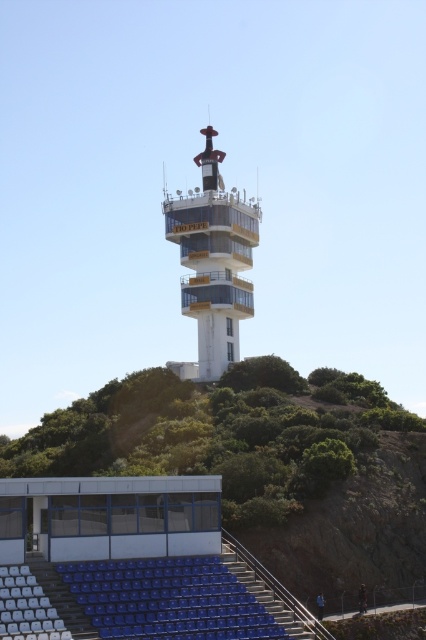
Does white glass amphitheater at lower left appear on the right side of white glossy tower at center?

No, white glass amphitheater at lower left is not to the right of white glossy tower at center.

Can you confirm if white glass amphitheater at lower left is positioned above white glossy tower at center?

No, white glass amphitheater at lower left is not above white glossy tower at center.

Find the location of a particular element. Image resolution: width=426 pixels, height=640 pixels. white glass amphitheater at lower left is located at coordinates (112, 516).

Locate an element on the screen. The height and width of the screenshot is (640, 426). white glass amphitheater at lower left is located at coordinates (112, 516).

Which is more to the right, green leafy hillside at upper center or blue plastic seats at lower left?

green leafy hillside at upper center is more to the right.

Which is behind, point (379, 579) or point (210, 524)?

The point (379, 579) is more distant.

This screenshot has width=426, height=640. In order to click on green leafy hillside at upper center in this screenshot , I will do `click(261, 464)`.

Is green leafy hillside at upper center below white glass amphitheater at lower left?

Actually, green leafy hillside at upper center is above white glass amphitheater at lower left.

Does green leafy hillside at upper center appear on the right side of white glass amphitheater at lower left?

Correct, you'll find green leafy hillside at upper center to the right of white glass amphitheater at lower left.

Locate an element on the screen. This screenshot has width=426, height=640. green leafy hillside at upper center is located at coordinates (261, 464).